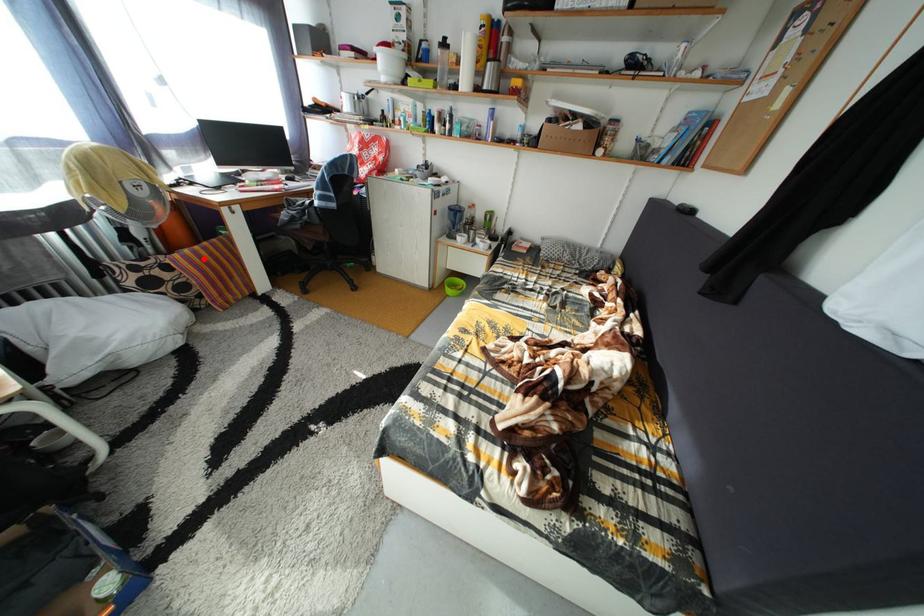
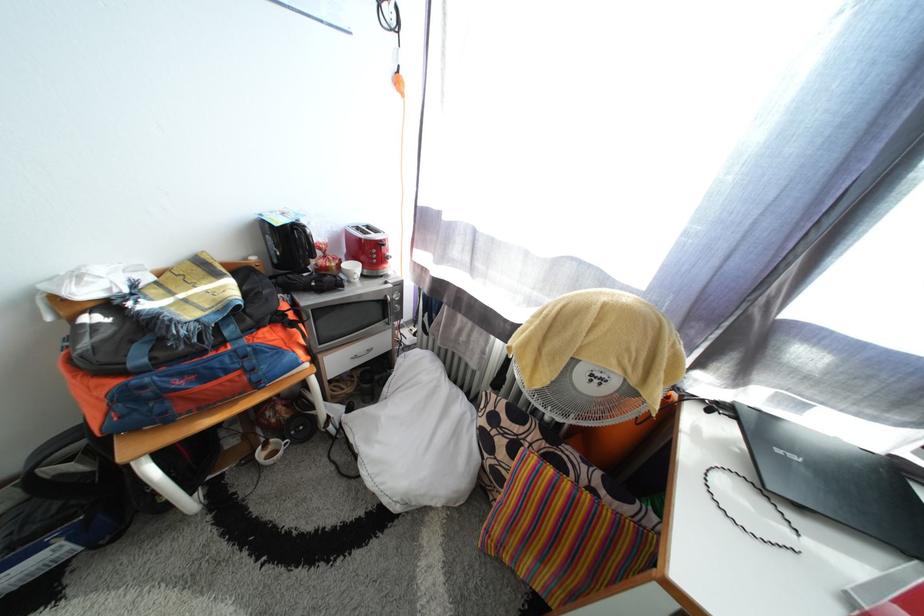
Where in the second image is the point corresponding to the highlighted location from the first image?

(563, 493)